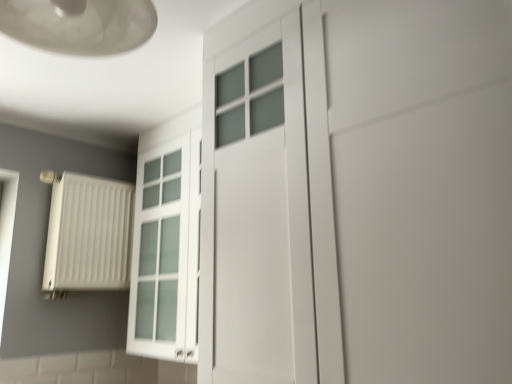
Question: From the image's perspective, is matte glass lampshade at upper left located above white matte door at center?

Choices:
 (A) yes
 (B) no

Answer: (A)

Question: Does matte glass lampshade at upper left turn towards white matte door at center?

Choices:
 (A) no
 (B) yes

Answer: (A)

Question: Can you confirm if matte glass lampshade at upper left is positioned to the right of white matte door at center?

Choices:
 (A) yes
 (B) no

Answer: (B)

Question: From the image's perspective, is matte glass lampshade at upper left beneath white matte door at center?

Choices:
 (A) yes
 (B) no

Answer: (B)

Question: Is matte glass lampshade at upper left not near white matte door at center?

Choices:
 (A) yes
 (B) no

Answer: (B)

Question: From a real-world perspective, is white matte radiator at left above or below matte glass lampshade at upper left?

Choices:
 (A) above
 (B) below

Answer: (B)

Question: Considering the positions of white matte radiator at left and matte glass lampshade at upper left in the image, is white matte radiator at left bigger or smaller than matte glass lampshade at upper left?

Choices:
 (A) big
 (B) small

Answer: (A)

Question: Choose the correct answer: Is white matte radiator at left inside matte glass lampshade at upper left or outside it?

Choices:
 (A) inside
 (B) outside

Answer: (B)

Question: Based on their positions, is white matte radiator at left located to the left or right of matte glass lampshade at upper left?

Choices:
 (A) left
 (B) right

Answer: (A)

Question: Looking at their shapes, would you say white matte door at center is wider or thinner than matte glass lampshade at upper left?

Choices:
 (A) thin
 (B) wide

Answer: (B)

Question: From a real-world perspective, is white matte door at center physically located above or below matte glass lampshade at upper left?

Choices:
 (A) above
 (B) below

Answer: (B)

Question: From the image's perspective, is white matte door at center above or below matte glass lampshade at upper left?

Choices:
 (A) above
 (B) below

Answer: (B)

Question: Considering the positions of white matte door at center and matte glass lampshade at upper left in the image, is white matte door at center bigger or smaller than matte glass lampshade at upper left?

Choices:
 (A) small
 (B) big

Answer: (B)

Question: Is point (96, 33) positioned closer to the camera than point (401, 218)?

Choices:
 (A) farther
 (B) closer

Answer: (B)

Question: In terms of size, does matte glass lampshade at upper left appear bigger or smaller than white matte door at center?

Choices:
 (A) small
 (B) big

Answer: (A)